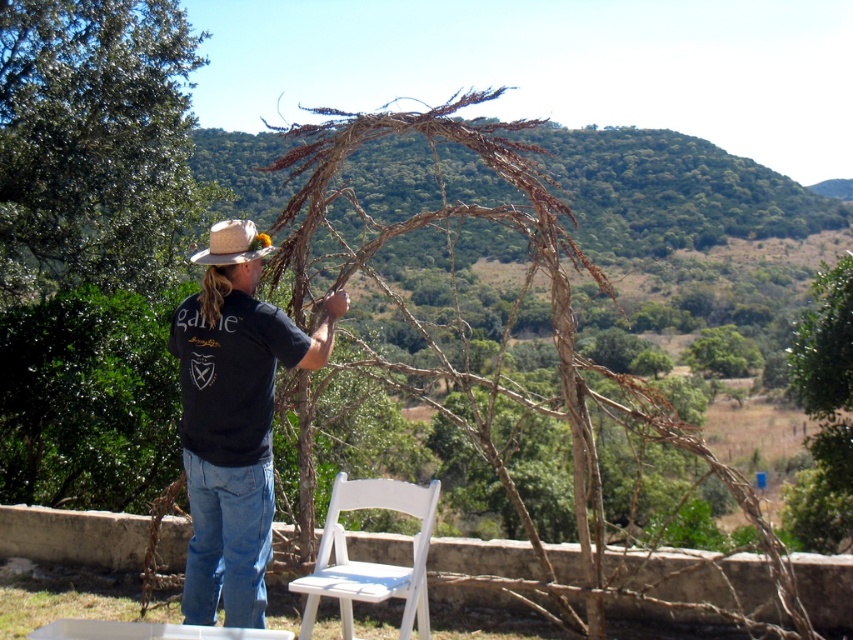
You are setting up decorations for an outdoor event and notice the black cotton shirt at center and the white wood chair at lower center. Which object is positioned higher in the scene?

The black cotton shirt at center is above the white wood chair at lower center, so it is positioned higher in the scene.

You are standing at the center of the image and want to move towards the white wood chair at lower center. Which direction should you move relative to your current position?

Since the white wood chair at lower center is located at point [367,561], you should move towards the lower center direction to reach it.